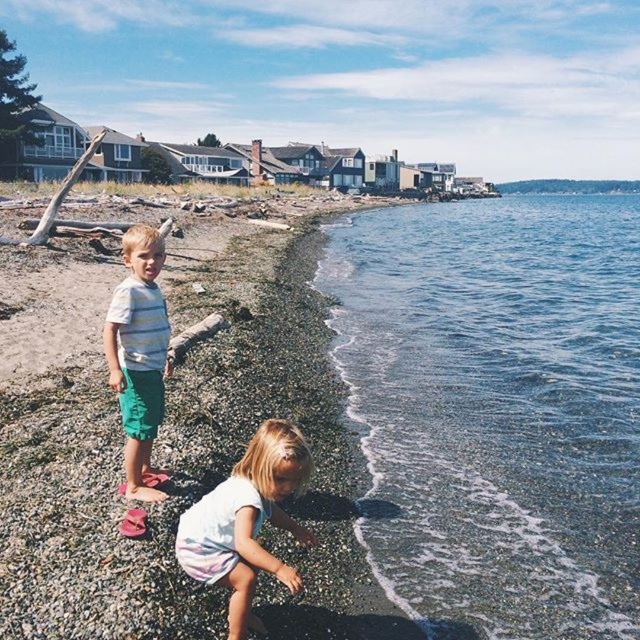
Between light pink cotton dress at lower center and striped cotton shirt at center, which one appears on the right side from the viewer's perspective?

From the viewer's perspective, light pink cotton dress at lower center appears more on the right side.

Is light pink cotton dress at lower center smaller than striped cotton shirt at center?

No.

Measure the distance between point (273, 436) and camera.

They are 3.98 meters apart.

The height and width of the screenshot is (640, 640). I want to click on light pink cotton dress at lower center, so click(x=244, y=518).

Who is shorter, clear water at lower right or smooth pebbles at lower left?

smooth pebbles at lower left

This screenshot has height=640, width=640. What do you see at coordinates (496, 410) in the screenshot?
I see `clear water at lower right` at bounding box center [496, 410].

Locate an element on the screen. Image resolution: width=640 pixels, height=640 pixels. clear water at lower right is located at coordinates (496, 410).

Where is `smooth pebbles at lower left`? This screenshot has width=640, height=640. smooth pebbles at lower left is located at coordinates (188, 472).

The height and width of the screenshot is (640, 640). Describe the element at coordinates (188, 472) in the screenshot. I see `smooth pebbles at lower left` at that location.

The width and height of the screenshot is (640, 640). I want to click on smooth pebbles at lower left, so click(188, 472).